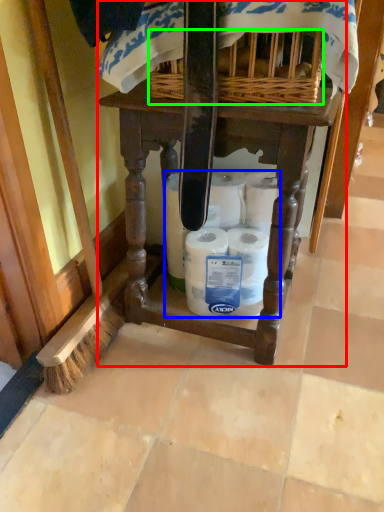
Question: Based on their relative distances, which object is nearer to furniture (highlighted by a red box)? Choose from toilet paper (highlighted by a blue box) and basket (highlighted by a green box).

Choices:
 (A) toilet paper
 (B) basket

Answer: (A)